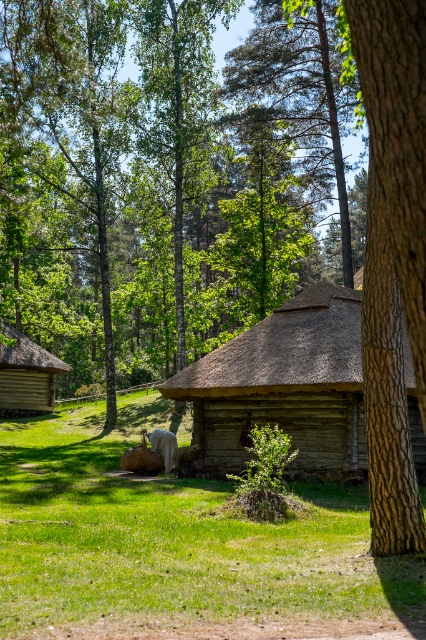
Question: Is green grass at center closer to camera compared to brown rough bark tree at center?

Choices:
 (A) yes
 (B) no

Answer: (B)

Question: Considering the real-world distances, which object is closest to the brown rough bark tree at center?

Choices:
 (A) green grass at center
 (B) wooden log cabin at center
 (C) wooden cabin at left

Answer: (A)

Question: Does brown rough bark tree at center have a lesser width compared to wooden cabin at left?

Choices:
 (A) no
 (B) yes

Answer: (A)

Question: Which object is the farthest from the wooden log cabin at center?

Choices:
 (A) brown rough bark tree at center
 (B) green grass at center
 (C) wooden cabin at left

Answer: (C)

Question: Does green grass at center appear under wooden log cabin at center?

Choices:
 (A) no
 (B) yes

Answer: (B)

Question: Which object is farther from the camera taking this photo?

Choices:
 (A) brown rough bark tree at center
 (B) green grass at center
 (C) wooden cabin at left
 (D) wooden log cabin at center

Answer: (C)